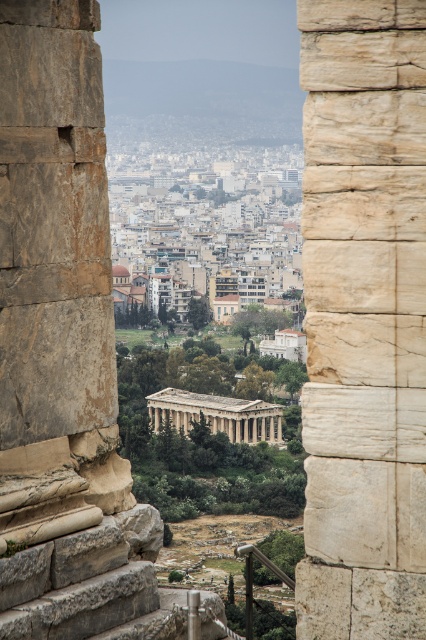
Question: Does white stone column at center appear under beige stone temple at center?

Choices:
 (A) yes
 (B) no

Answer: (B)

Question: Among these points, which one is farthest from the camera?

Choices:
 (A) (181, 413)
 (B) (405, 522)

Answer: (A)

Question: Can you confirm if white stone column at center is wider than beige stone temple at center?

Choices:
 (A) no
 (B) yes

Answer: (A)

Question: Does white stone column at center appear under beige stone temple at center?

Choices:
 (A) yes
 (B) no

Answer: (B)

Question: Which point is closer to the camera?

Choices:
 (A) (169, 417)
 (B) (350, 211)

Answer: (B)